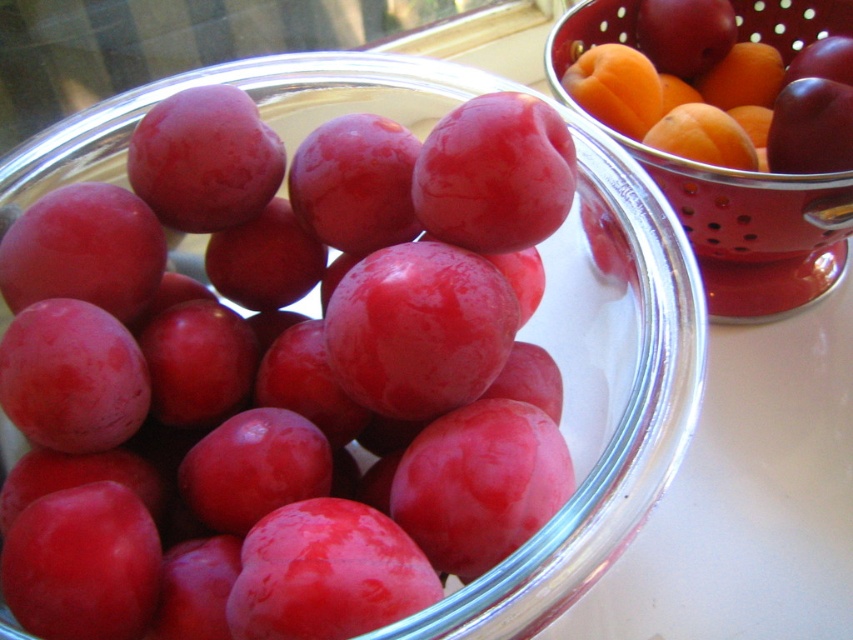
Question: Is glossy red plum at upper right smaller than orange matte at upper right?

Choices:
 (A) no
 (B) yes

Answer: (A)

Question: Is glossy red plum at upper right further to camera compared to orange matte at upper right?

Choices:
 (A) no
 (B) yes

Answer: (A)

Question: From the image, what is the correct spatial relationship of glossy red plum at upper right in relation to orange matte at upper right?

Choices:
 (A) right
 (B) left

Answer: (A)